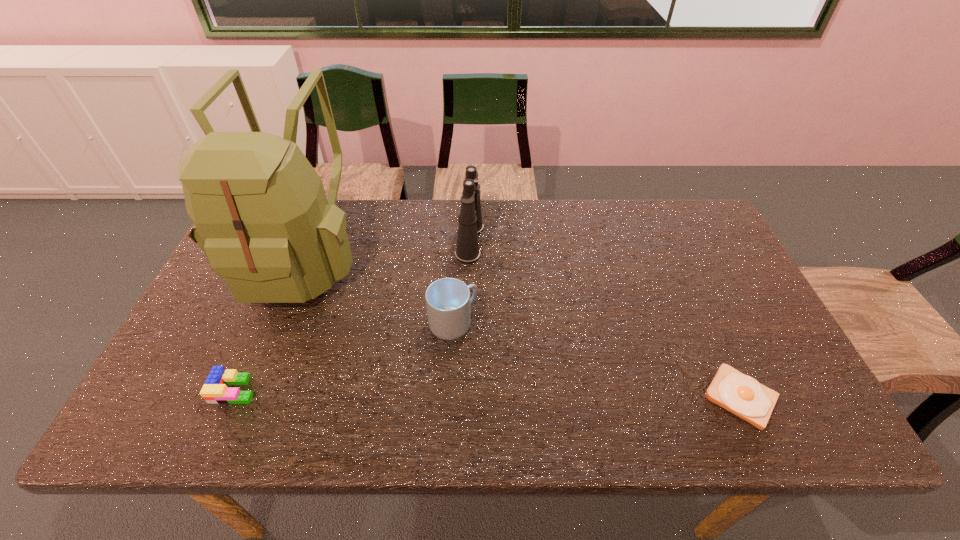
This screenshot has height=540, width=960. I want to click on object present at the near right corner, so click(x=740, y=394).

You are a GUI agent. You are given a task and a screenshot of the screen. Output one action in this format:
    pyautogui.click(x=<x>, y=<y>)
    Task: Click on the free location at the far edge
    
    Given the screenshot: What is the action you would take?
    pyautogui.click(x=552, y=237)

The width and height of the screenshot is (960, 540). Find the location of `vacant space at the near edge`. vacant space at the near edge is located at coordinates (438, 417).

The height and width of the screenshot is (540, 960). What are the coordinates of `vacant space at the right edge` in the screenshot? It's located at (733, 272).

The height and width of the screenshot is (540, 960). In order to click on vacant space at the near left corner of the desktop in this screenshot , I will do `click(153, 429)`.

The image size is (960, 540). In the image, there is a desktop. What are the coordinates of `blank space at the far right corner` in the screenshot? It's located at (659, 210).

This screenshot has height=540, width=960. Find the location of `empty space between the rightmost object and the backpack`. empty space between the rightmost object and the backpack is located at coordinates (521, 328).

At what (x,y) coordinates should I click in order to perform the action: click on free space that is in between the mug and the backpack. Please return your answer as a coordinate pair (x, y). Looking at the image, I should click on (377, 291).

Image resolution: width=960 pixels, height=540 pixels. Find the location of `free space between the rightmost object and the binoculars`. free space between the rightmost object and the binoculars is located at coordinates (606, 319).

Locate an element on the screen. vacant area that lies between the binoculars and the tallest object is located at coordinates (386, 250).